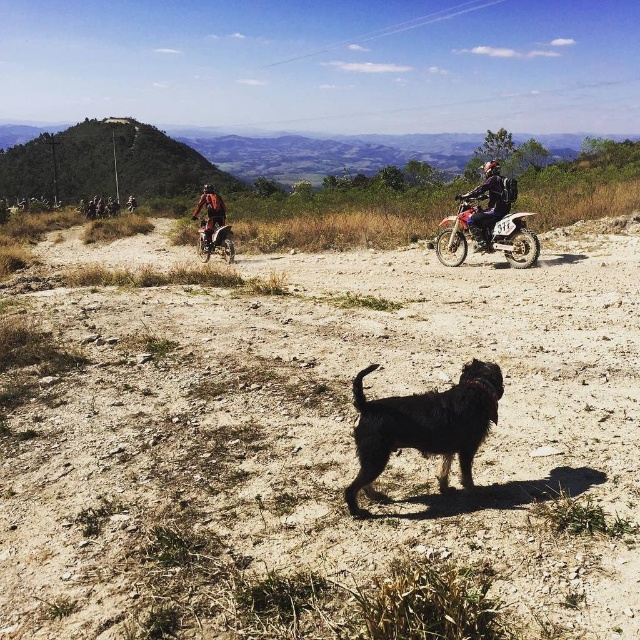
Looking at this image, you are standing at the point marked as point (195, 177) in the image. A drone is flying towards you from the direction of the small dark dog. The drone has a range of 200 feet. Will the drone be able to reach you before its battery runs out?

The distance of point (195, 177) from viewer is 171.61 feet. Since the drone has a range of 200 feet, it can reach you before its battery runs out.